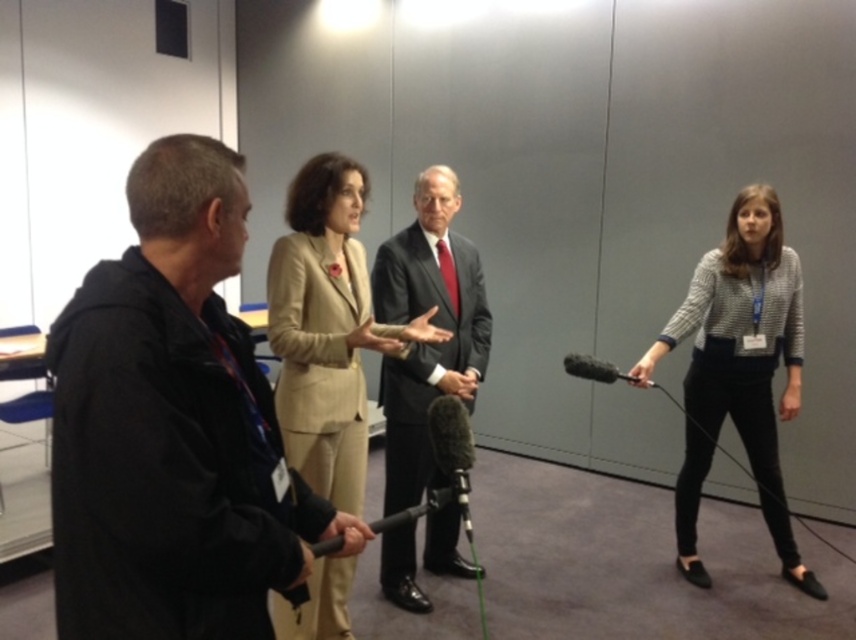
In the scene shown: You are organizing a small event and need to seat two speakers. The first speaker is wearing a black matte jacket at left, and the second speaker is wearing a dark gray suit at center. If the stage has a podium that is 1.2 meters wide, can both speakers stand side by side comfortably?

The black matte jacket at left is wider than the dark gray suit at center. Since the podium is 1.2 meters wide, and the combined width of both speakers would depend on their individual widths, but since the black matte jacket at left is already wider, it might exceed the podium width if they stand side by side. However, without exact measurements, it is uncertain. Please check the actual space.

You are a sound technician who needs to adjust the microphone to ensure it is within the optimal 1.5 meters range for clear audio pickup from the speaker wearing the dark gray suit at center. The black matte microphone at center is currently positioned 1.36 meters away. Is the microphone within the recommended distance?

The distance between the dark gray suit at center and the black matte microphone at center is 1.36 meters, which is within the optimal 1.5 meters range for clear audio pickup. Therefore, the microphone is positioned correctly.